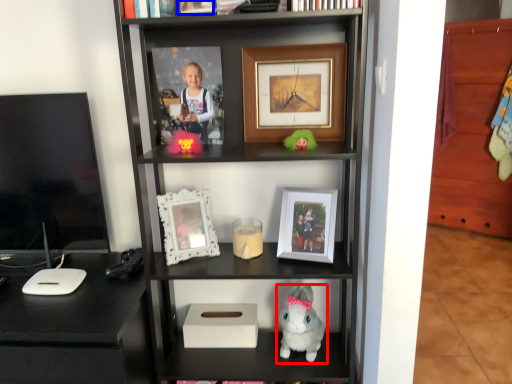
Question: Which object appears farthest to the camera in this image, toy (highlighted by a red box) or picture frame (highlighted by a blue box)?

Choices:
 (A) toy
 (B) picture frame

Answer: (A)